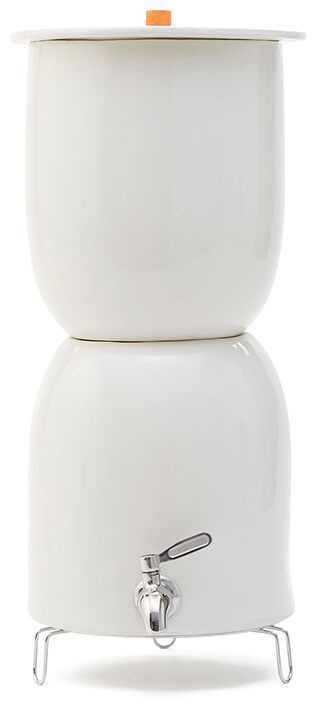
You are a GUI agent. You are given a task and a screenshot of the screen. Output one action in this format:
    pyautogui.click(x=<x>, y=<y>)
    Task: Click on the ceramic
    Image resolution: width=317 pixels, height=703 pixels.
    Given the screenshot: What is the action you would take?
    [265, 394]